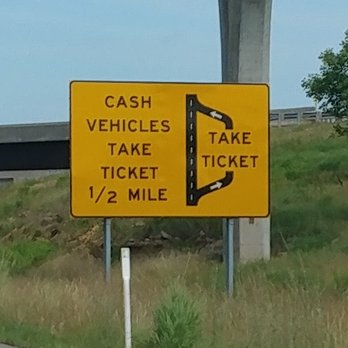
Identify the location of wall. Image resolution: width=348 pixels, height=348 pixels. (272, 117), (289, 116), (307, 116).